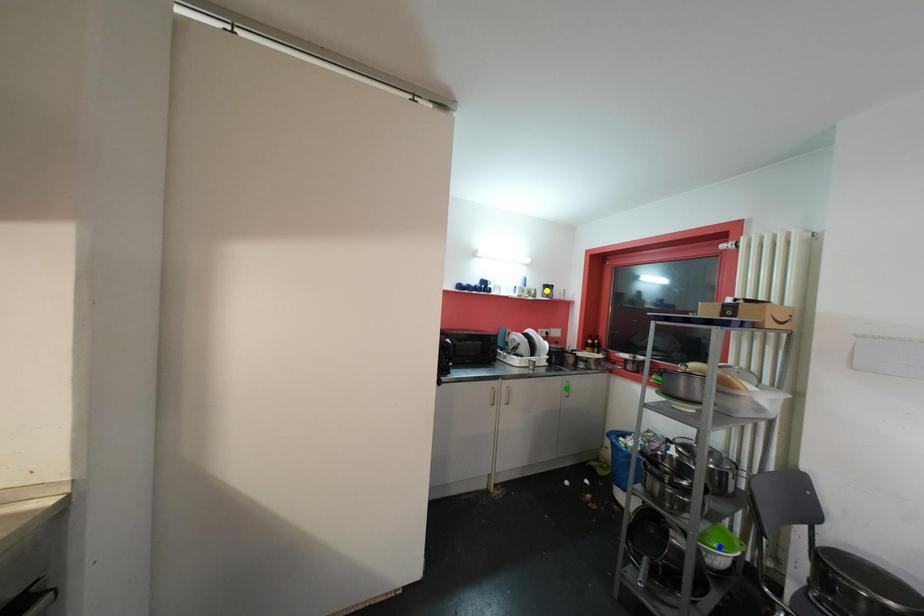
Order these from farthest to nearest:
yellow point | green point | blue point

yellow point
green point
blue point